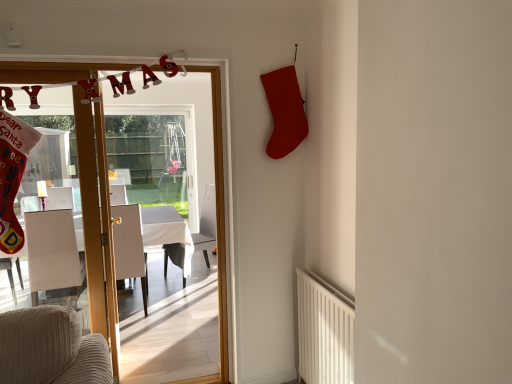
Measure the distance between point (140, 231) and camera.

Point (140, 231) and camera are 12.65 feet apart from each other.

Describe the element at coordinates (145, 238) in the screenshot. I see `white glossy table at left` at that location.

Locate an element on the screen. The height and width of the screenshot is (384, 512). white glossy door at center is located at coordinates (97, 221).

Locate an element on the screen. The height and width of the screenshot is (384, 512). door that is above the white fabric armchair at center, which appears as the 2th armchair when viewed from the right (from a real-world perspective) is located at coordinates (97, 221).

Is white fabric armchair at center, which appears as the 2th armchair when viewed from the right, inside the boundaries of white glossy door at center, or outside?

white fabric armchair at center, which appears as the 2th armchair when viewed from the right, is not inside white glossy door at center, it's outside.

Is white fabric armchair at center, placed as the 2th armchair when sorted from left to right, oriented away from white glossy door at center?

Yes, white fabric armchair at center, placed as the 2th armchair when sorted from left to right, is facing away from white glossy door at center.

Looking at this image, would you say white glossy door at center is inside or outside white textured radiator at lower right?

white glossy door at center is not inside white textured radiator at lower right, it's outside.

Which of these two, white glossy door at center or white textured radiator at lower right, is thinner?

Thinner between the two is white textured radiator at lower right.

Are white glossy door at center and white textured radiator at lower right beside each other?

No, white glossy door at center is not with white textured radiator at lower right.

Based on their sizes in the image, would you say white glossy door at center is bigger or smaller than white textured radiator at lower right?

Clearly, white glossy door at center is larger in size than white textured radiator at lower right.

Is white fabric armchair at center, placed as the 2th armchair when sorted from left to right, aimed at white glossy table at left?

Yes, white fabric armchair at center, placed as the 2th armchair when sorted from left to right, is facing white glossy table at left.

Is white fabric armchair at center, placed as the 2th armchair when sorted from left to right, beside white glossy table at left?

There is a gap between white fabric armchair at center, placed as the 2th armchair when sorted from left to right, and white glossy table at left.

At what (x,y) coordinates should I click in order to perform the action: click on table directly beneath the white fabric armchair at center, which appears as the 2th armchair when viewed from the right (from a real-world perspective). Please return your answer as a coordinate pair (x, y). This screenshot has height=384, width=512. Looking at the image, I should click on (145, 238).

From their relative heights in the image, would you say white fabric armchair at center, which appears as the 2th armchair when viewed from the right, is taller or shorter than white glossy table at left?

In the image, white fabric armchair at center, which appears as the 2th armchair when viewed from the right, appears to be taller than white glossy table at left.

Would you say white glossy door at center is part of white glossy table at left's contents?

No, white glossy door at center is not a part of white glossy table at left.

Are white glossy table at left and white glossy door at center far apart?

white glossy table at left is far away from white glossy door at center.

How far apart are white glossy table at left and white glossy door at center?

A distance of 1.25 meters exists between white glossy table at left and white glossy door at center.

From the image's perspective, relative to white glossy door at center, is white glossy table at left above or below?

Based on their image positions, white glossy table at left is located beneath white glossy door at center.

Is point (210, 210) less distant than point (163, 206)?

No, (210, 210) is behind (163, 206).

Does white fabric armchair at center, positioned as the third armchair in left-to-right order, appear on the right side of white glossy table at left?

Correct, you'll find white fabric armchair at center, positioned as the third armchair in left-to-right order, to the right of white glossy table at left.

Can we say white fabric armchair at center, positioned as the third armchair in left-to-right order, lies outside white glossy table at left?

white fabric armchair at center, positioned as the third armchair in left-to-right order, lies outside white glossy table at left's area.

How far apart are white fabric armchair at center, positioned as the third armchair in left-to-right order, and white glossy table at left?

white fabric armchair at center, positioned as the third armchair in left-to-right order, and white glossy table at left are 15.00 inches apart from each other.

This screenshot has width=512, height=384. Identify the location of armchair that appears behind the white fabric armchair at center, placed as the 2th armchair when sorted from left to right. (206, 225).

How distant is white fabric armchair at center, positioned as the third armchair in left-to-right order, from white fabric armchair at center, which appears as the 2th armchair when viewed from the right?

white fabric armchair at center, positioned as the third armchair in left-to-right order, and white fabric armchair at center, which appears as the 2th armchair when viewed from the right, are 30.11 inches apart from each other.

Is white fabric armchair at center, the first armchair positioned from the right, next to white fabric armchair at center, which appears as the 2th armchair when viewed from the right?

No, white fabric armchair at center, the first armchair positioned from the right, is not beside white fabric armchair at center, which appears as the 2th armchair when viewed from the right.

How far apart are white fabric armchair at center, positioned as the third armchair in left-to-right order, and white fabric armchair at left, marked as the 3th armchair in a right-to-left arrangement?

white fabric armchair at center, positioned as the third armchair in left-to-right order, is 1.25 meters away from white fabric armchair at left, marked as the 3th armchair in a right-to-left arrangement.

Locate an element on the screen. armchair that is the 2nd one above the white fabric armchair at center, positioned as the third armchair in left-to-right order (from a real-world perspective) is located at coordinates [x=53, y=253].

Considering the sizes of white fabric armchair at center, positioned as the third armchair in left-to-right order, and white fabric armchair at left, marked as the 3th armchair in a right-to-left arrangement, in the image, is white fabric armchair at center, positioned as the third armchair in left-to-right order, taller or shorter than white fabric armchair at left, marked as the 3th armchair in a right-to-left arrangement,?

Considering their sizes, white fabric armchair at center, positioned as the third armchair in left-to-right order, has more height than white fabric armchair at left, marked as the 3th armchair in a right-to-left arrangement.

Is point (164, 256) in front of point (51, 248)?

No.

What are the coordinates of `door located on the right of white fabric armchair at center, which appears as the 2th armchair when viewed from the right` in the screenshot? It's located at (97, 221).

The width and height of the screenshot is (512, 384). What are the coordinates of `radiator below the white glossy door at center (from the image's perspective)` in the screenshot? It's located at (323, 332).

Considering their positions, is white fabric armchair at center, positioned as the third armchair in left-to-right order, positioned further to white glossy door at center than white textured radiator at lower right?

white fabric armchair at center, positioned as the third armchair in left-to-right order, lies further to white glossy door at center than the other object.

Estimate the real-world distances between objects in this image. Which object is further from white textured radiator at lower right, white glossy door at center or white fabric armchair at center, the first armchair positioned from the right?

white fabric armchair at center, the first armchair positioned from the right, is positioned further to the anchor white textured radiator at lower right.

When comparing their distances from white textured radiator at lower right, does white fabric armchair at center, which appears as the 2th armchair when viewed from the right, or white fabric armchair at left, marked as the 3th armchair in a right-to-left arrangement, seem closer?

The object closer to white textured radiator at lower right is white fabric armchair at center, which appears as the 2th armchair when viewed from the right.

Which object lies further to the anchor point white glossy door at center, white fabric armchair at center, positioned as the third armchair in left-to-right order, or white glossy table at left?

Based on the image, white fabric armchair at center, positioned as the third armchair in left-to-right order, appears to be further to white glossy door at center.

Considering their positions, is white textured radiator at lower right positioned further to white fabric armchair at center, placed as the 2th armchair when sorted from left to right, than white fabric armchair at center, the first armchair positioned from the right?

white textured radiator at lower right.

Considering their positions, is white fabric armchair at center, placed as the 2th armchair when sorted from left to right, positioned closer to white fabric armchair at left, which ranks as the 1th armchair in left-to-right order, than white glossy table at left?

white fabric armchair at center, placed as the 2th armchair when sorted from left to right, lies closer to white fabric armchair at left, which ranks as the 1th armchair in left-to-right order, than the other object.

Looking at the image, which one is located closer to white textured radiator at lower right, white glossy table at left or white glossy door at center?

white glossy door at center lies closer to white textured radiator at lower right than the other object.

Estimate the real-world distances between objects in this image. Which object is further from white glossy table at left, white fabric armchair at left, marked as the 3th armchair in a right-to-left arrangement, or white textured radiator at lower right?

The object further to white glossy table at left is white textured radiator at lower right.

At what (x,y) coordinates should I click in order to perform the action: click on door between white glossy table at left and white textured radiator at lower right in the horizontal direction. Please return your answer as a coordinate pair (x, y). The image size is (512, 384). Looking at the image, I should click on pyautogui.click(x=97, y=221).

Where is `table positioned between white textured radiator at lower right and white fabric armchair at center, positioned as the third armchair in left-to-right order, from near to far`? This screenshot has width=512, height=384. table positioned between white textured radiator at lower right and white fabric armchair at center, positioned as the third armchair in left-to-right order, from near to far is located at coordinates (145, 238).

Where is `table positioned between white glossy door at center and white fabric armchair at center, the first armchair positioned from the right, from near to far`? The image size is (512, 384). table positioned between white glossy door at center and white fabric armchair at center, the first armchair positioned from the right, from near to far is located at coordinates (145, 238).

Where is `armchair between white fabric armchair at left, marked as the 3th armchair in a right-to-left arrangement, and white fabric armchair at center, positioned as the third armchair in left-to-right order, in the horizontal direction`? armchair between white fabric armchair at left, marked as the 3th armchair in a right-to-left arrangement, and white fabric armchair at center, positioned as the third armchair in left-to-right order, in the horizontal direction is located at coordinates (129, 246).